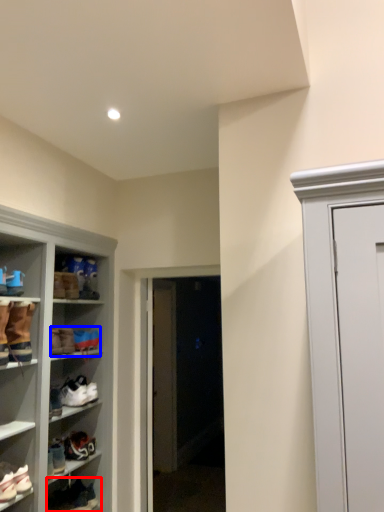
Question: Which object appears farthest to the camera in this image, footwear (highlighted by a red box) or footwear (highlighted by a blue box)?

Choices:
 (A) footwear
 (B) footwear

Answer: (B)